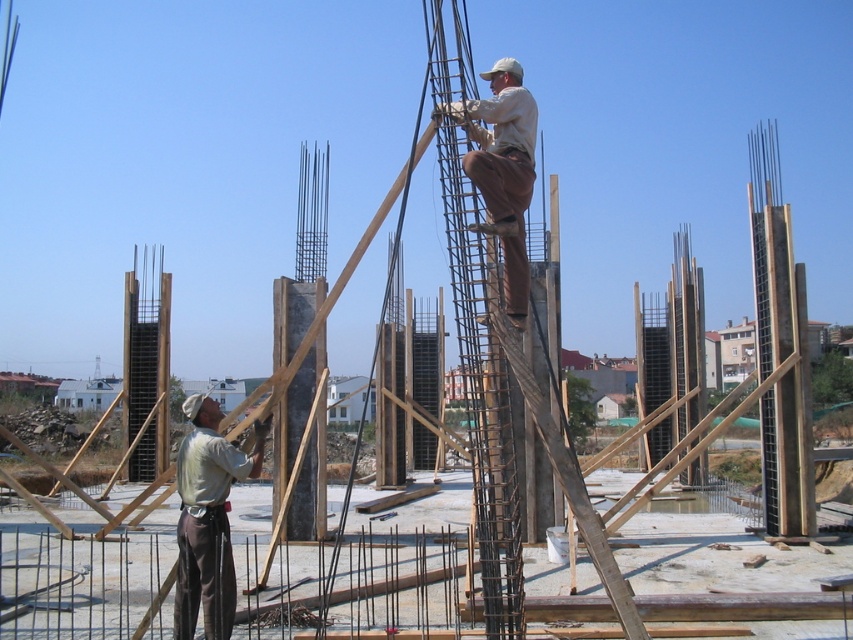
Is the position of rusty metal ladder at center more distant than that of gray cotton shirt at lower left?

No.

Between rusty metal ladder at center and gray cotton shirt at lower left, which one is positioned lower?

gray cotton shirt at lower left is below.

The width and height of the screenshot is (853, 640). Find the location of `rusty metal ladder at center`. rusty metal ladder at center is located at coordinates (482, 396).

Consider the image. Between gray cotton shirt at lower left and brown cotton pants at upper center, which one has more height?

With more height is brown cotton pants at upper center.

Is gray cotton shirt at lower left to the right of brown cotton pants at upper center from the viewer's perspective?

Incorrect, gray cotton shirt at lower left is not on the right side of brown cotton pants at upper center.

Image resolution: width=853 pixels, height=640 pixels. Describe the element at coordinates (207, 518) in the screenshot. I see `gray cotton shirt at lower left` at that location.

What are the coordinates of `gray cotton shirt at lower left` in the screenshot? It's located at (207, 518).

The height and width of the screenshot is (640, 853). Find the location of `rusty metal ladder at center`. rusty metal ladder at center is located at coordinates (482, 396).

Is point (465, 387) behind point (508, 134)?

No, it is not.

You are a GUI agent. You are given a task and a screenshot of the screen. Output one action in this format:
    pyautogui.click(x=<x>, y=<y>)
    Task: Click on the rusty metal ladder at center
    
    Given the screenshot: What is the action you would take?
    pyautogui.click(x=482, y=396)